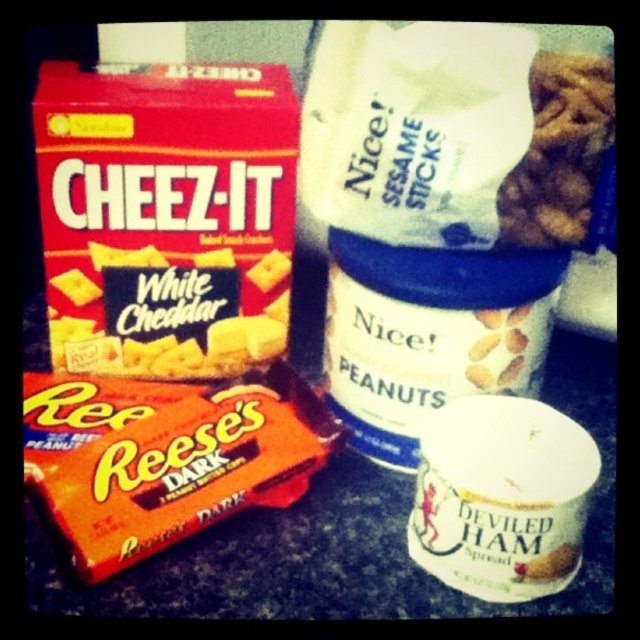
Looking at this image, is white matte deviled ham spread at lower right bigger than white cheddar cheese at upper left?

Indeed, white matte deviled ham spread at lower right has a larger size compared to white cheddar cheese at upper left.

Locate an element on the screen. The height and width of the screenshot is (640, 640). white matte deviled ham spread at lower right is located at coordinates (500, 497).

Is white cheddar cheez-it at left further to camera compared to brown crumbly cookie at upper right?

Yes, white cheddar cheez-it at left is further from the viewer.

How much distance is there between white cheddar cheez-it at left and brown crumbly cookie at upper right?

13.94 inches

At what (x,y) coordinates should I click in order to perform the action: click on white cheddar cheez-it at left. Please return your answer as a coordinate pair (x, y). Image resolution: width=640 pixels, height=640 pixels. Looking at the image, I should click on (166, 218).

Locate an element on the screen. white cheddar cheez-it at left is located at coordinates (166, 218).

Is point (269, 84) positioned before point (484, 515)?

No, (269, 84) is behind (484, 515).

In the scene shown: Which of these two, white cheddar cheez-it at left or white matte deviled ham spread at lower right, stands shorter?

Standing shorter between the two is white matte deviled ham spread at lower right.

Describe the element at coordinates (166, 218) in the screenshot. I see `white cheddar cheez-it at left` at that location.

The height and width of the screenshot is (640, 640). Identify the location of white cheddar cheez-it at left. (166, 218).